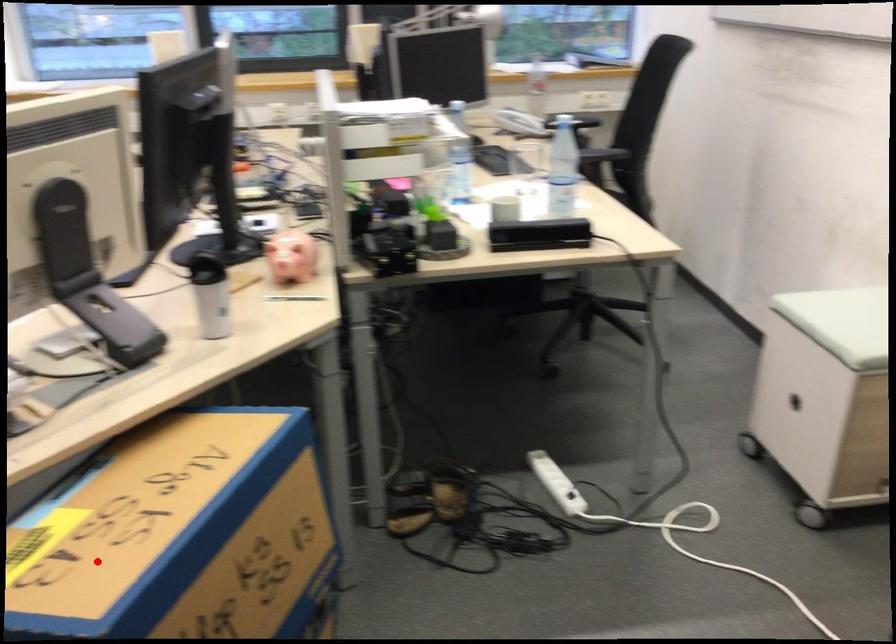
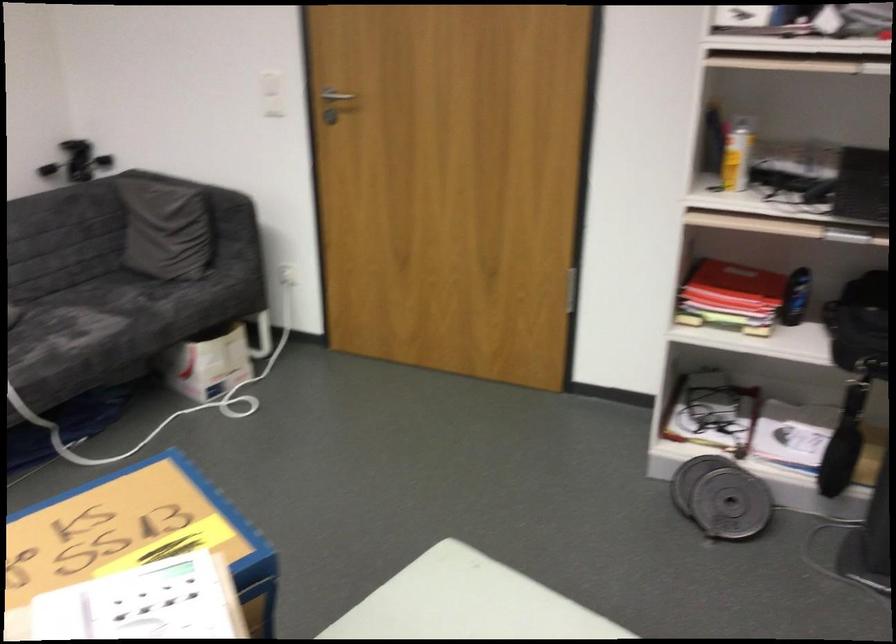
Question: A red point is marked in image1. In image2, is the corresponding 3D point closer to the camera or farther? Reply with the corresponding letter.

Choices:
 (A) The corresponding 3D point is closer.
 (B) The corresponding 3D point is farther.

Answer: (B)